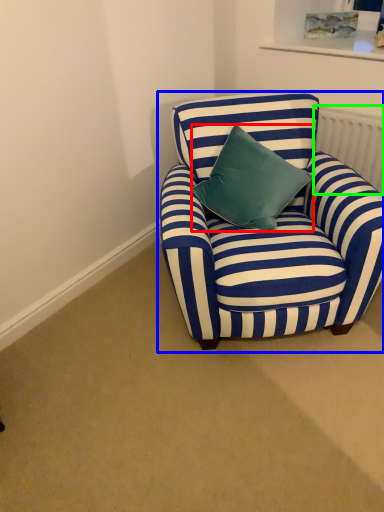
Question: Considering the real-world distances, which object is closest to pillow (highlighted by a red box)? chair (highlighted by a blue box) or radiator (highlighted by a green box).

Choices:
 (A) chair
 (B) radiator

Answer: (A)